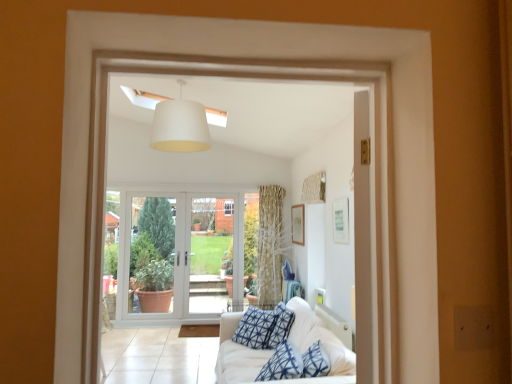
Question: Is clear glass door at center, the 1th screen door viewed from the left, positioned in front of wooden picture frame at upper right, the first picture frame from the back?

Choices:
 (A) no
 (B) yes

Answer: (A)

Question: From a real-world perspective, is clear glass door at center, the 1th screen door viewed from the left, positioned under wooden picture frame at upper right, marked as the 1th picture frame in a left-to-right arrangement, based on gravity?

Choices:
 (A) no
 (B) yes

Answer: (B)

Question: Is clear glass door at center, the 1th screen door viewed from the left, facing towards wooden picture frame at upper right, the first picture frame from the back?

Choices:
 (A) yes
 (B) no

Answer: (B)

Question: Considering the relative sizes of clear glass door at center, which ranks as the second screen door in right-to-left order, and wooden picture frame at upper right, which is the 2th picture frame in front-to-back order, in the image provided, is clear glass door at center, which ranks as the second screen door in right-to-left order, wider than wooden picture frame at upper right, which is the 2th picture frame in front-to-back order,?

Choices:
 (A) yes
 (B) no

Answer: (A)

Question: From the image's perspective, does clear glass door at center, the 1th screen door viewed from the left, appear lower than wooden picture frame at upper right, which is the 2th picture frame from right to left?

Choices:
 (A) yes
 (B) no

Answer: (A)

Question: Can you confirm if clear glass door at center, the 1th screen door viewed from the left, is shorter than wooden picture frame at upper right, marked as the 1th picture frame in a left-to-right arrangement?

Choices:
 (A) no
 (B) yes

Answer: (A)

Question: From the image's perspective, is white fabric couch at lower right above clear glass door at center, the 1th screen door viewed from the left?

Choices:
 (A) no
 (B) yes

Answer: (A)

Question: Is white fabric couch at lower right not near clear glass door at center, which ranks as the second screen door in right-to-left order?

Choices:
 (A) no
 (B) yes

Answer: (B)

Question: Does white fabric couch at lower right have a lesser width compared to clear glass door at center, which ranks as the second screen door in right-to-left order?

Choices:
 (A) yes
 (B) no

Answer: (B)

Question: Would you say clear glass door at center, the 1th screen door viewed from the left, is part of white fabric couch at lower right's contents?

Choices:
 (A) no
 (B) yes

Answer: (A)

Question: From a real-world perspective, is white fabric couch at lower right on top of clear glass door at center, which ranks as the second screen door in right-to-left order?

Choices:
 (A) no
 (B) yes

Answer: (A)

Question: Considering the relative sizes of white fabric couch at lower right and clear glass door at center, the 1th screen door viewed from the left, in the image provided, is white fabric couch at lower right smaller than clear glass door at center, the 1th screen door viewed from the left,?

Choices:
 (A) yes
 (B) no

Answer: (B)

Question: From the image's perspective, is white glass door at center, the 1th screen door positioned from the right, beneath white matte lampshade at upper center?

Choices:
 (A) no
 (B) yes

Answer: (B)